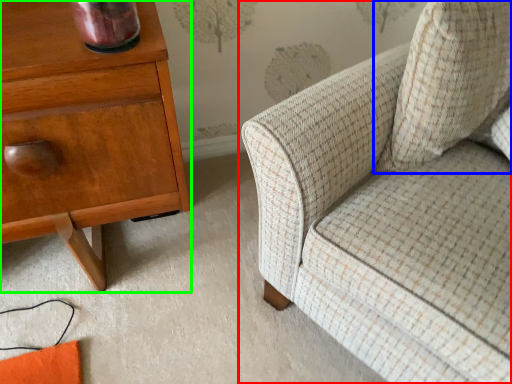
Question: Which is nearer to the chair (highlighted by a red box)? throw pillow (highlighted by a blue box) or nightstand (highlighted by a green box).

Choices:
 (A) throw pillow
 (B) nightstand

Answer: (A)